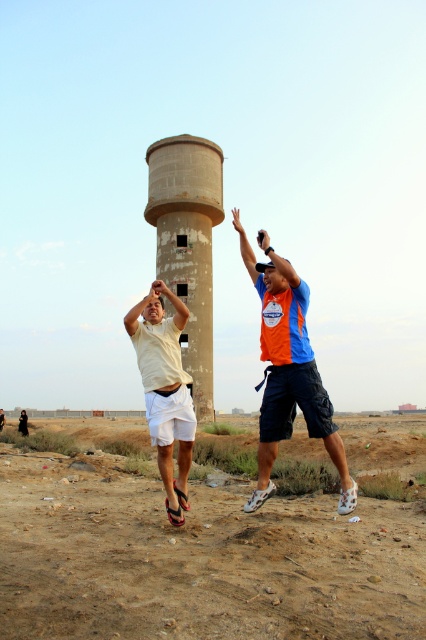
Question: Does concrete water tower at center appear over white matte shorts at center?

Choices:
 (A) yes
 (B) no

Answer: (A)

Question: Among these points, which one is farthest from the camera?

Choices:
 (A) (198, 221)
 (B) (276, 301)
 (C) (170, 490)
 (D) (356, 628)

Answer: (A)

Question: Can you confirm if brown sandy dirt at lower center is positioned to the left of white matte shorts at center?

Choices:
 (A) yes
 (B) no

Answer: (B)

Question: Which point appears closest to the camera in this image?

Choices:
 (A) (193, 422)
 (B) (198, 468)
 (C) (172, 262)

Answer: (A)

Question: Does orange fabric shirt at center appear on the right side of white matte shorts at center?

Choices:
 (A) yes
 (B) no

Answer: (A)

Question: Estimate the real-world distances between objects in this image. Which object is closer to the white matte shorts at center?

Choices:
 (A) concrete water tower at center
 (B) brown sandy dirt at lower center

Answer: (B)